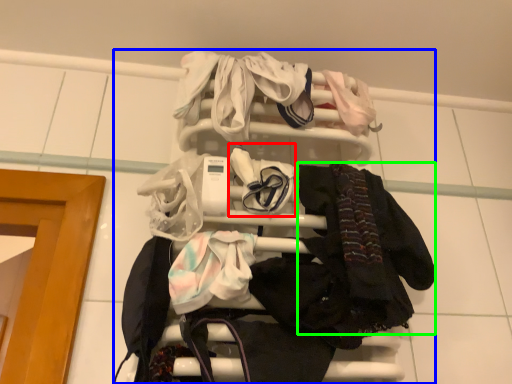
Question: Based on their relative distances, which object is farther from baby clothe (highlighted by a red box)? Choose from bunk bed (highlighted by a blue box) and clothing (highlighted by a green box).

Choices:
 (A) bunk bed
 (B) clothing

Answer: (B)